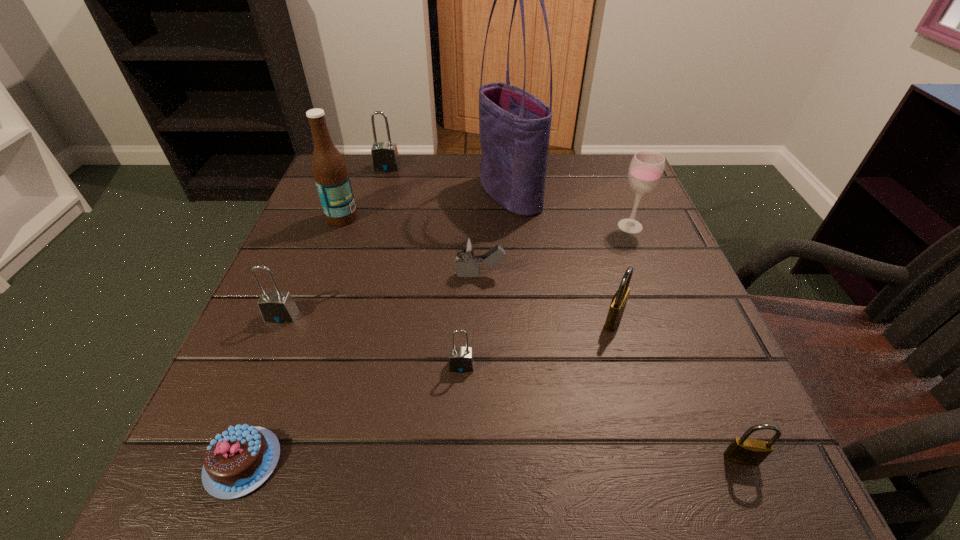
Where is `tote bag`? This screenshot has height=540, width=960. tote bag is located at coordinates 514,126.

Where is `purple tote bag`? The width and height of the screenshot is (960, 540). purple tote bag is located at coordinates (514, 126).

Where is `the second tallest object`? The image size is (960, 540). the second tallest object is located at coordinates (330, 172).

Locate an element on the screen. wineglass is located at coordinates (646, 169).

The image size is (960, 540). I want to click on the biggest gray padlock, so click(385, 158).

Locate an element on the screen. the farthest padlock is located at coordinates (385, 158).

Image resolution: width=960 pixels, height=540 pixels. Find the location of `the leftmost gray padlock`. the leftmost gray padlock is located at coordinates (277, 306).

At what (x,y) coordinates should I click in order to perform the action: click on the second farthest gray padlock. Please return your answer as a coordinate pair (x, y). Looking at the image, I should click on (277, 306).

This screenshot has height=540, width=960. Find the location of `the bigger brass padlock`. the bigger brass padlock is located at coordinates (619, 300).

Identify the location of the farther brass padlock. (619, 300).